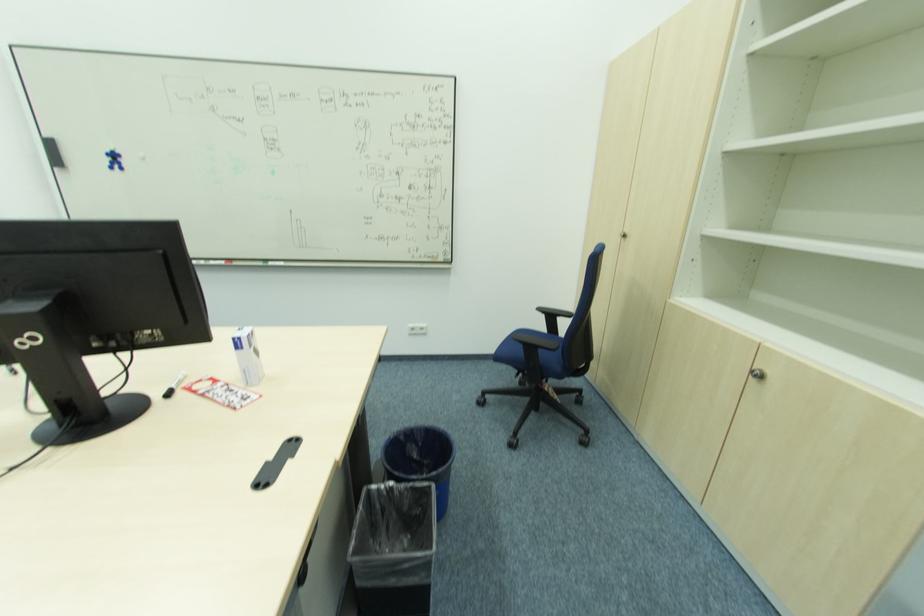
Identify the location of blue magnet figure. The image size is (924, 616). (114, 160).